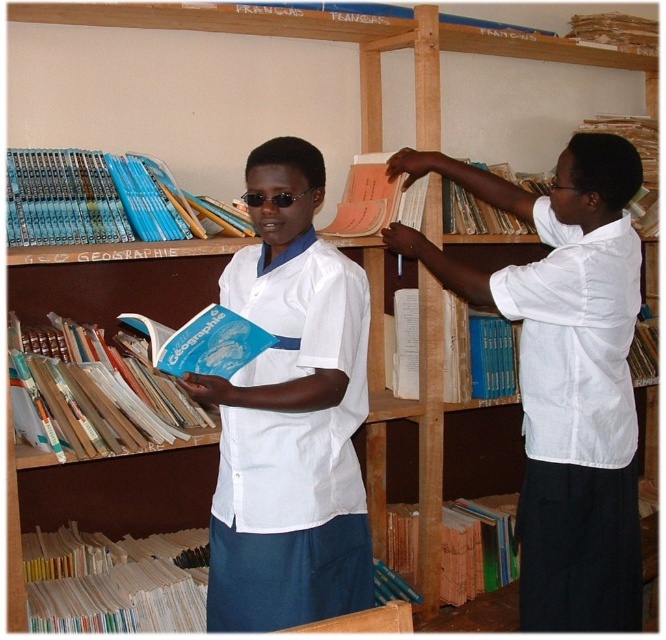
Can you confirm if white matte shirt at upper right is thinner than blue paperbacks at upper left?

No.

The height and width of the screenshot is (640, 666). I want to click on white matte shirt at upper right, so click(x=563, y=374).

Find the location of `white matte shirt at upper right`. white matte shirt at upper right is located at coordinates (563, 374).

Does matte orange book at upper center have a greater height compared to blue paper book at lower center?

Yes.

How much distance is there between matte orange book at upper center and blue paper book at lower center?

The distance of matte orange book at upper center from blue paper book at lower center is 4.75 feet.

Measure the distance between point (480,225) and camera.

The distance of point (480,225) from camera is 2.37 meters.

In order to click on matte orange book at upper center in this screenshot , I will do (476, 214).

Between point (210, 563) and point (653, 214), which one is positioned in front?

Positioned in front is point (210, 563).

Which is more to the right, white matte shirt at center or matte paper book at upper right?

Positioned to the right is matte paper book at upper right.

At what (x,y) coordinates should I click in order to perform the action: click on white matte shirt at center. Please return your answer as a coordinate pair (x, y). Looking at the image, I should click on coord(288,413).